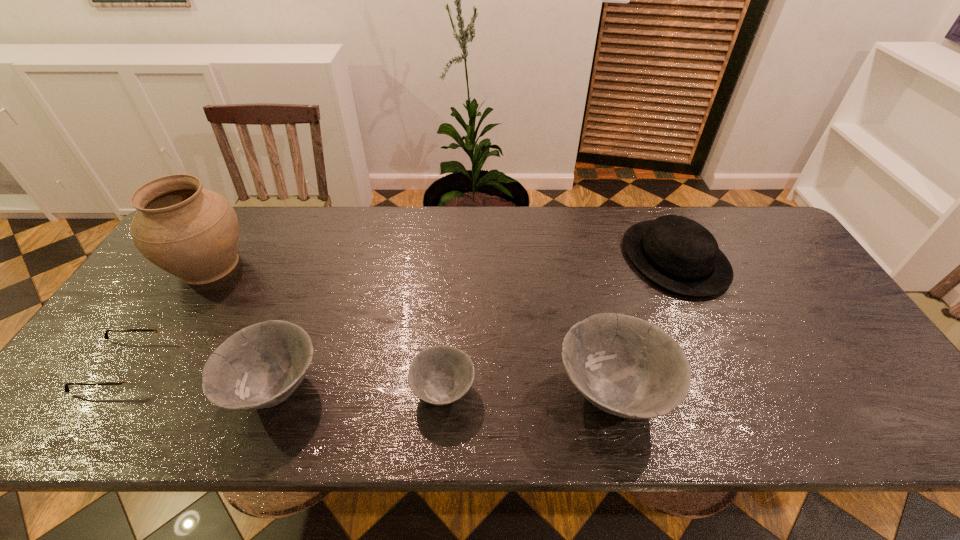
Image resolution: width=960 pixels, height=540 pixels. I want to click on object present at the near left corner, so click(136, 373).

You are a GUI agent. You are given a task and a screenshot of the screen. Output one action in this format:
    pyautogui.click(x=<x>, y=<y>)
    Task: Click on the vacant space at the far edge of the desktop
    
    Given the screenshot: What is the action you would take?
    pyautogui.click(x=636, y=220)

Where is `vacant space at the near edge of the desktop`? Image resolution: width=960 pixels, height=540 pixels. vacant space at the near edge of the desktop is located at coordinates (181, 394).

In the image, there is a desktop. Find the location of `vacant space at the left edge`. vacant space at the left edge is located at coordinates (131, 348).

This screenshot has height=540, width=960. I want to click on vacant space at the right edge, so click(865, 364).

Locate an element on the screen. The height and width of the screenshot is (540, 960). free space at the near left corner is located at coordinates (111, 390).

The width and height of the screenshot is (960, 540). In the image, there is a desktop. Find the location of `vacant space at the near right corner`. vacant space at the near right corner is located at coordinates (825, 393).

Locate an element on the screen. The width and height of the screenshot is (960, 540). blank region between the urn and the rightmost object is located at coordinates (442, 262).

Image resolution: width=960 pixels, height=540 pixels. Identify the location of free spot between the urn and the rightmost bowl. (411, 329).

Locate an element on the screen. This screenshot has height=540, width=960. free space between the third object from right to left and the second tallest bowl is located at coordinates (359, 390).